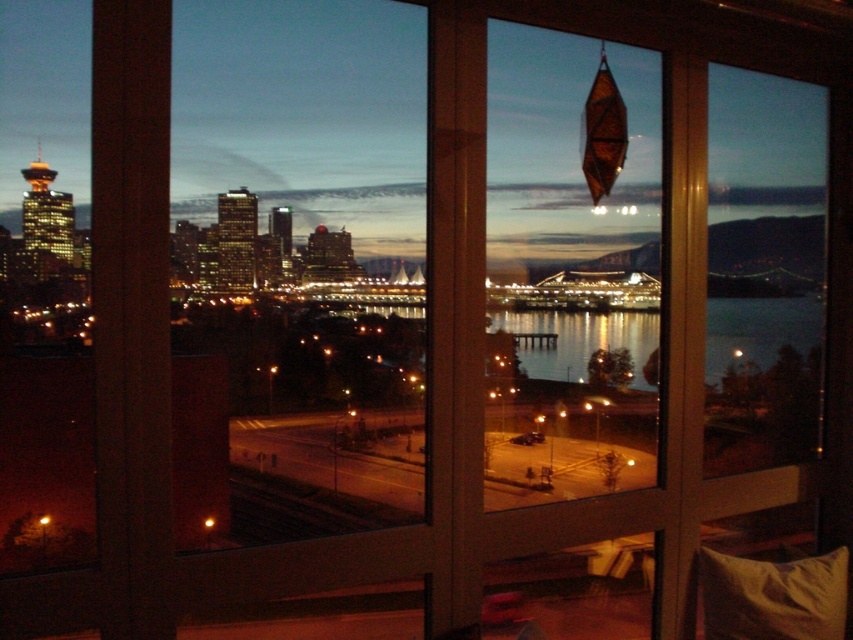
You are sitting in the room and want to reach both the reflective glass water at center and the soft beige pillow at lower right. Which object is easier to grab without moving your current position?

The reflective glass water at center is closer to the viewer than the soft beige pillow at lower right, so it is easier to grab without moving.

You are sitting in a room with a large window and notice two items in your view. One is the reflective glass water at center and the other is the soft beige pillow at lower right. Which of these two items appears larger in size?

The reflective glass water at center appears larger in size than the soft beige pillow at lower right.

You are standing in the room looking out the window. There is a point marked at coordinates (767, 348) on the window. If you want to touch this point with a 3.5 meter long pole, will the pole be long enough?

The point at (767, 348) is 3.02 meters away from the viewer. Since the pole is 3.5 meters long, which is longer than the distance, the pole will be long enough to reach the point.